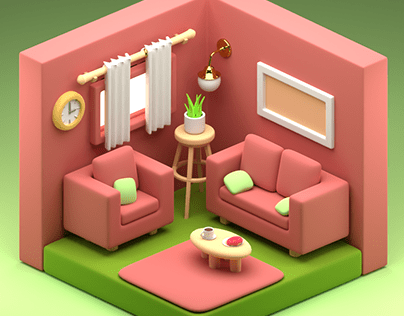
The width and height of the screenshot is (404, 316). In order to click on bulb in this screenshot , I will do `click(211, 84)`.